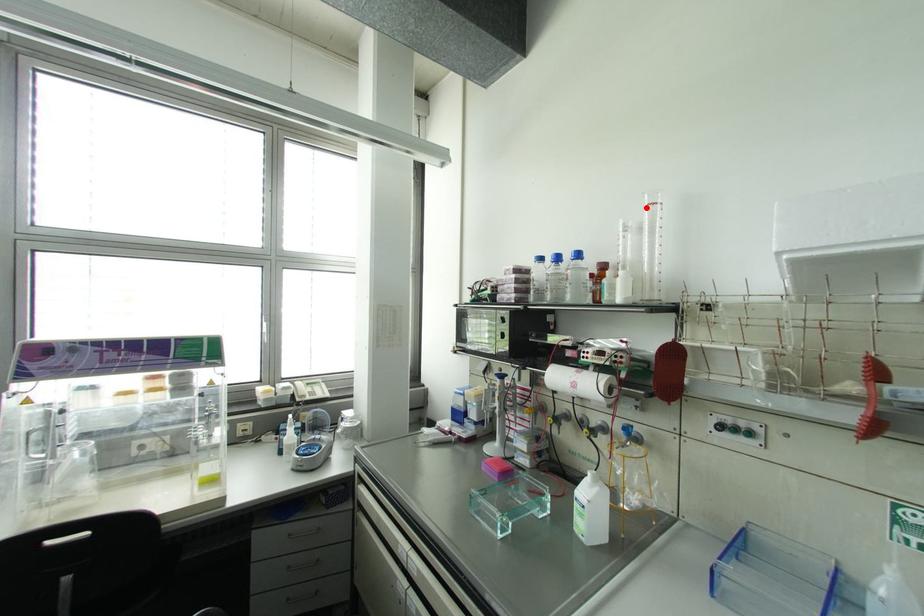
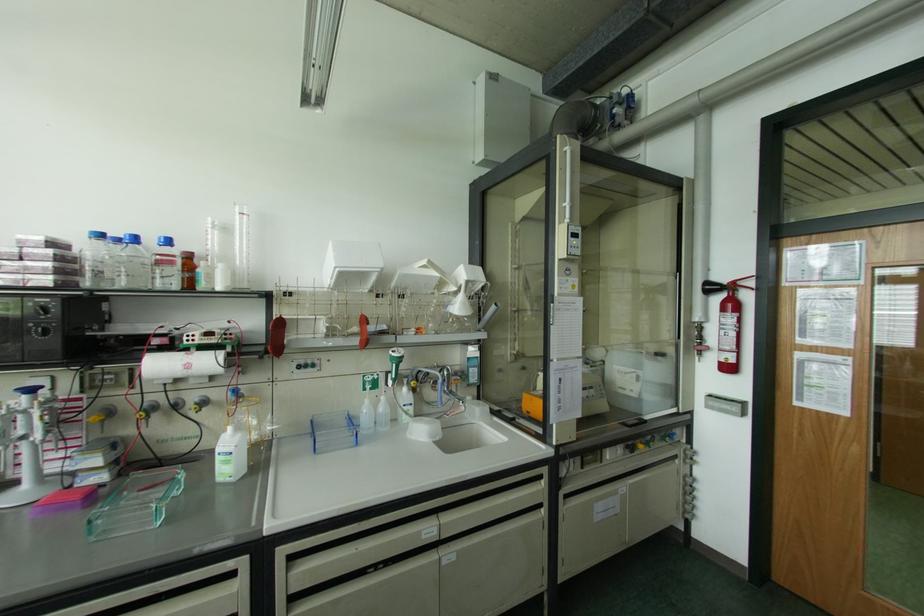
In the second image, find the point that corresponds to the highlighted location in the first image.

(237, 216)